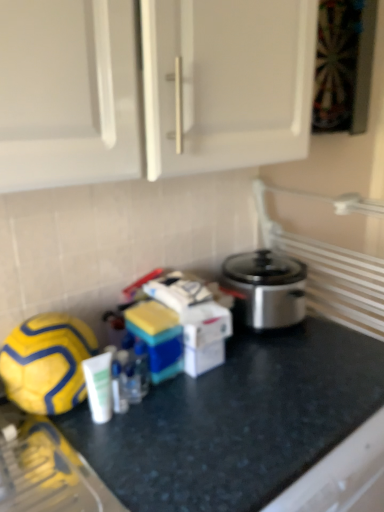
Question: Considering the positions of point (34, 390) and point (321, 373), is point (34, 390) closer or farther from the camera than point (321, 373)?

Choices:
 (A) farther
 (B) closer

Answer: (B)

Question: Which is correct: yellow matte football at lower left is inside black granite countertop at center, or outside of it?

Choices:
 (A) inside
 (B) outside

Answer: (B)

Question: From a real-world perspective, is yellow matte football at lower left above or below black granite countertop at center?

Choices:
 (A) above
 (B) below

Answer: (A)

Question: Is black granite countertop at center taller or shorter than yellow matte football at lower left?

Choices:
 (A) short
 (B) tall

Answer: (B)

Question: From the image's perspective, is black granite countertop at center positioned above or below yellow matte football at lower left?

Choices:
 (A) above
 (B) below

Answer: (B)

Question: Is black granite countertop at center bigger or smaller than yellow matte football at lower left?

Choices:
 (A) big
 (B) small

Answer: (A)

Question: Considering the positions of point (347, 351) and point (46, 366), is point (347, 351) closer or farther from the camera than point (46, 366)?

Choices:
 (A) closer
 (B) farther

Answer: (B)